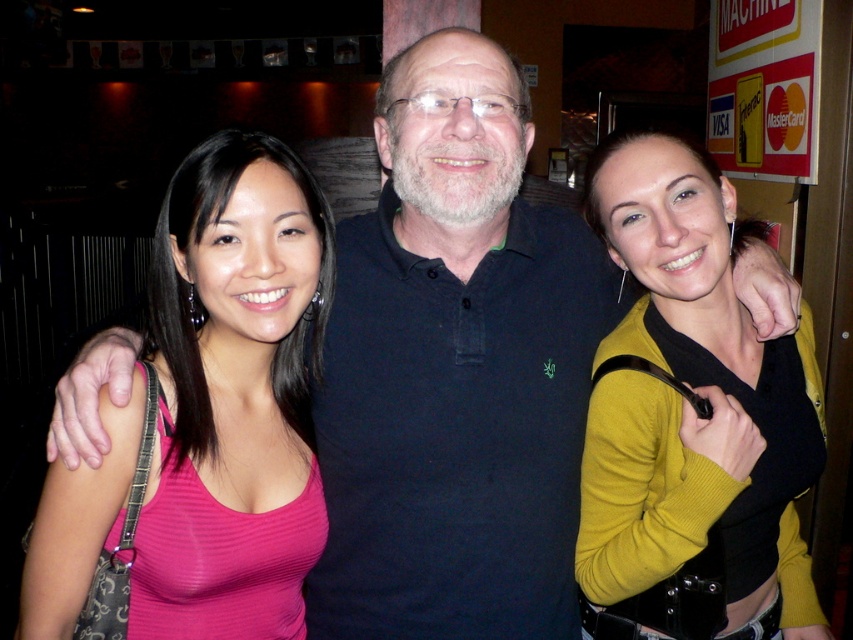
Based on the scene description, which clothing item is shorter in length between the pink ribbed tank top at left and the mustard yellow sweater at center?

The pink ribbed tank top at left is shorter than the mustard yellow sweater at center.

You are taking a photo of the three people in the scene. You want to focus on the point that is closer to the camera. Which point should you choose between point (x=223, y=388) and point (x=674, y=374)?

Point (x=223, y=388) is closer to the camera than point (x=674, y=374), so you should choose point (x=223, y=388) to focus on.